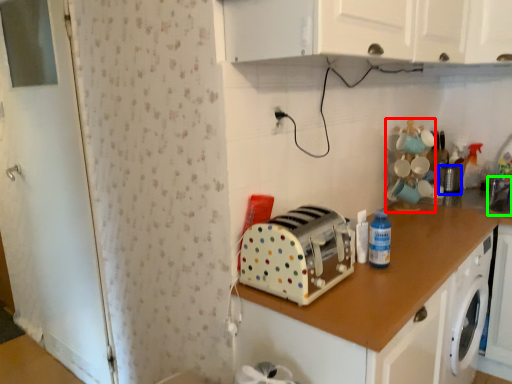
Question: Estimate the real-world distances between objects in this image. Which object is farther from toy (highlighted by a red box), appliance (highlighted by a blue box) or sink (highlighted by a green box)?

Choices:
 (A) appliance
 (B) sink

Answer: (B)